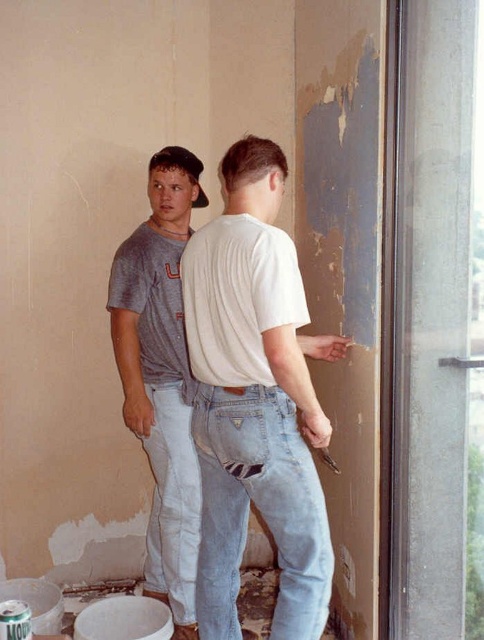
Question: Is white matte t-shirt at center bigger than gray cotton t-shirt at left?

Choices:
 (A) no
 (B) yes

Answer: (B)

Question: Which point is farther to the camera?

Choices:
 (A) gray cotton t-shirt at left
 (B) white matte t-shirt at center

Answer: (A)

Question: Which of the following is the farthest from the observer?

Choices:
 (A) white matte t-shirt at center
 (B) gray cotton t-shirt at left

Answer: (B)

Question: Is white matte t-shirt at center to the left of gray cotton t-shirt at left from the viewer's perspective?

Choices:
 (A) no
 (B) yes

Answer: (A)

Question: Does white matte t-shirt at center have a larger size compared to gray cotton t-shirt at left?

Choices:
 (A) yes
 (B) no

Answer: (A)

Question: Which point is closer to the camera taking this photo?

Choices:
 (A) (188, 419)
 (B) (309, 563)

Answer: (B)